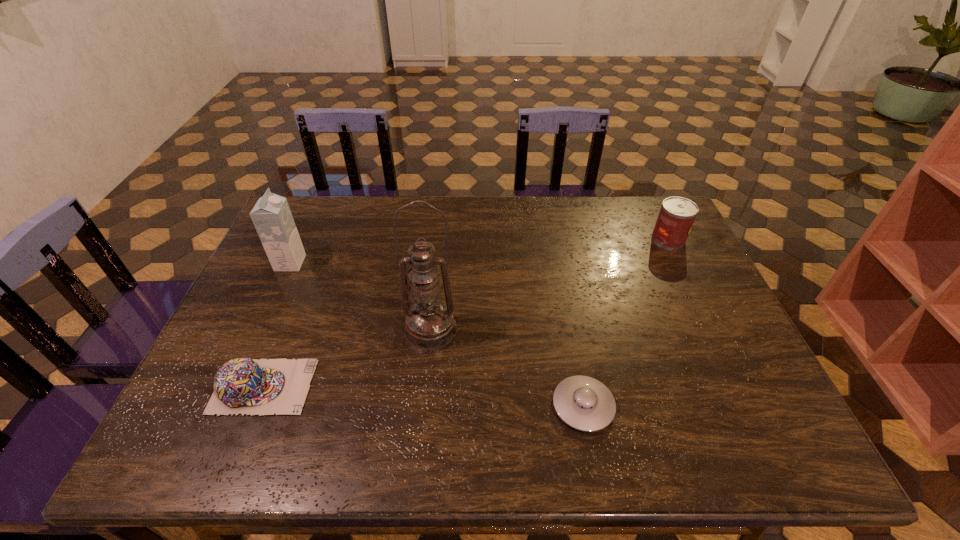
In the image, there is a desktop. Find the location of `vacant area at the far edge`. vacant area at the far edge is located at coordinates (468, 234).

Image resolution: width=960 pixels, height=540 pixels. I want to click on vacant region at the near edge, so click(503, 443).

Identify the location of vacant space at the left edge of the desktop. (242, 418).

At what (x,y) coordinates should I click in order to perform the action: click on blank space at the right edge of the desktop. Please return your answer as a coordinate pair (x, y). Image resolution: width=960 pixels, height=540 pixels. Looking at the image, I should click on (693, 310).

At what (x,y) coordinates should I click in order to perform the action: click on vacant space at the near left corner of the desktop. Please return your answer as a coordinate pair (x, y). Looking at the image, I should click on (191, 435).

You are a GUI agent. You are given a task and a screenshot of the screen. Output one action in this format:
    pyautogui.click(x=<x>, y=<y>)
    Task: Click on the free spot between the third farthest object and the can
    
    Given the screenshot: What is the action you would take?
    pyautogui.click(x=550, y=284)

I want to click on vacant space that is in between the fourth shortest object and the fourth tallest object, so click(277, 325).

Find the location of `vacant region between the third object from left to right and the saucer`. vacant region between the third object from left to right and the saucer is located at coordinates click(507, 367).

Identify the location of free space between the carton and the third tallest object. (479, 251).

Image resolution: width=960 pixels, height=540 pixels. I want to click on vacant region between the rightmost object and the second farthest object, so click(479, 251).